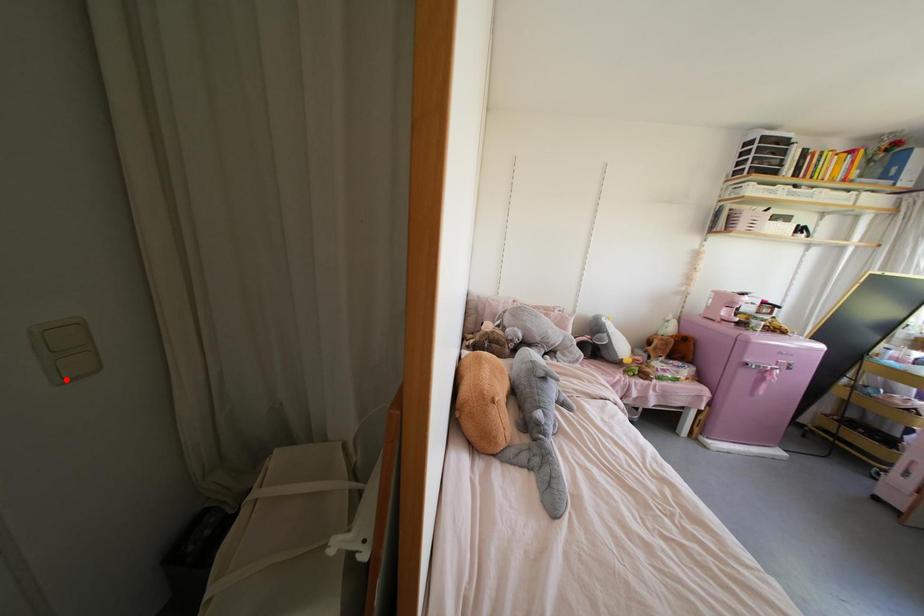
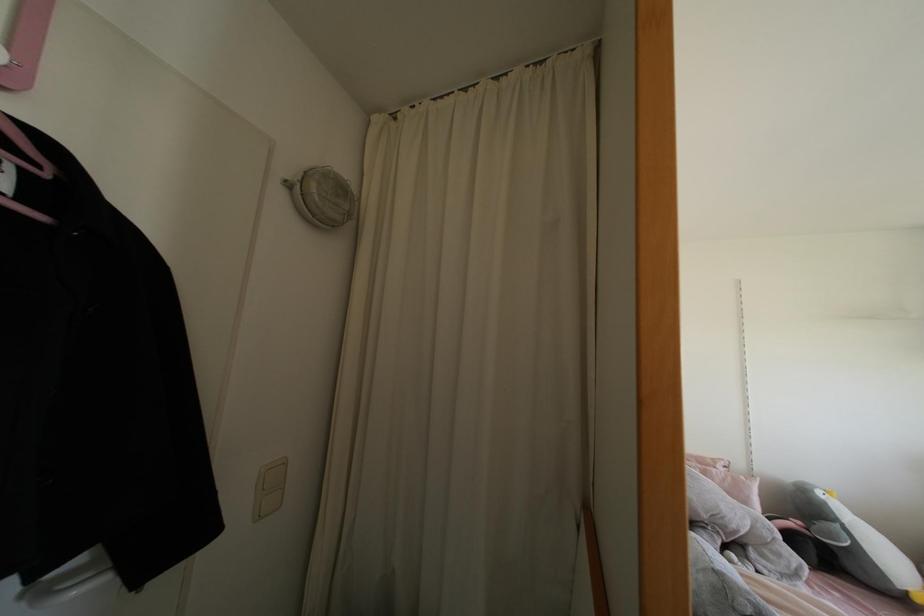
Where in the second image is the point corresponding to the highlighted location from the first image?

(259, 517)